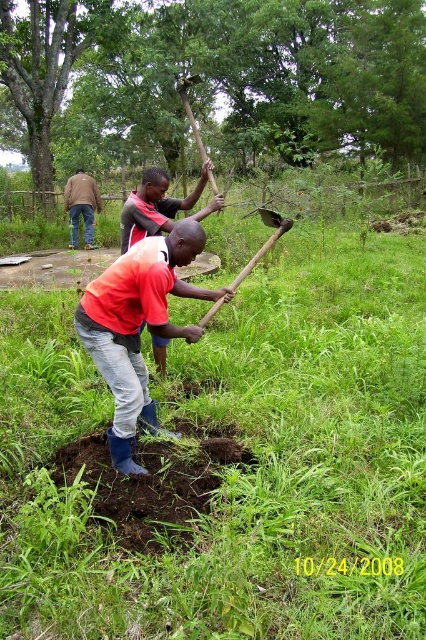
Question: Which of the following is the farthest from the observer?

Choices:
 (A) (112, 38)
 (B) (209, 317)

Answer: (A)

Question: Does green grass at center have a larger size compared to wooden shovel at center?

Choices:
 (A) yes
 (B) no

Answer: (A)

Question: Which object is positioned farthest from the wooden shovel at center?

Choices:
 (A) denim jacket at upper left
 (B) green grass at center
 (C) red shirt at center
 (D) matte red shirt at center

Answer: (A)

Question: Is the position of matte red shirt at center more distant than that of wooden shovel at center?

Choices:
 (A) yes
 (B) no

Answer: (B)

Question: Is red shirt at center positioned behind denim jacket at upper left?

Choices:
 (A) no
 (B) yes

Answer: (A)

Question: Which object is the farthest from the green grass at center?

Choices:
 (A) wooden shovel at center
 (B) green leafy tree at upper center
 (C) matte red shirt at center
 (D) red shirt at center

Answer: (B)